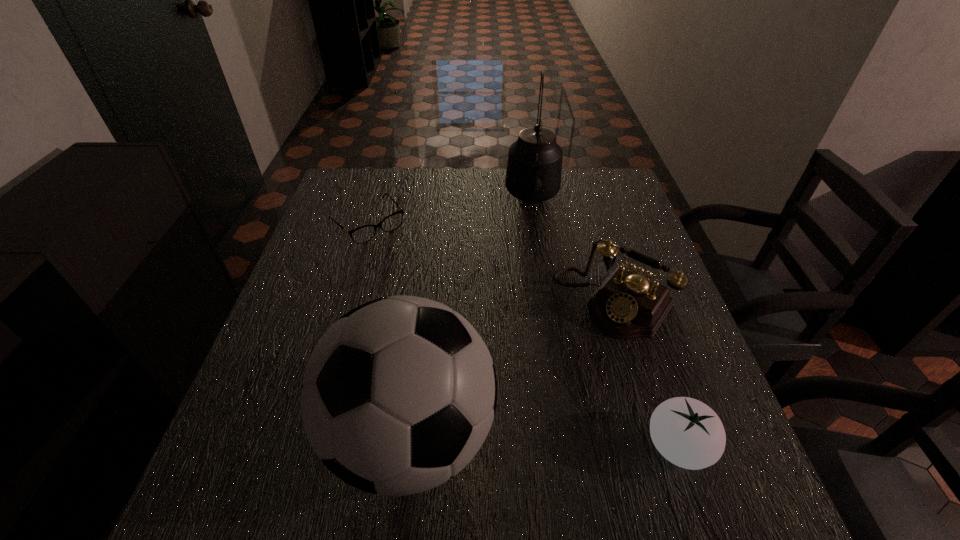
In order to click on free space located 0.070m on the dial of the third farthest object in this screenshot , I will do `click(568, 351)`.

Find the location of a particular element. The image size is (960, 540). vacant space located spout on the tallest object is located at coordinates (532, 319).

Identify the location of vacant area located 0.400m spout on the tallest object. Image resolution: width=960 pixels, height=540 pixels. (532, 329).

I want to click on vacant area situated spout on the tallest object, so click(533, 294).

Image resolution: width=960 pixels, height=540 pixels. What are the coordinates of `free space located 0.210m on the front-facing side of the spectacles` in the screenshot? It's located at (429, 287).

Identify the location of free location located on the front-facing side of the spectacles. This screenshot has width=960, height=540. (473, 333).

Locate an element on the screen. The image size is (960, 540). free space located on the front-facing side of the spectacles is located at coordinates tap(438, 296).

Identify the location of kettle present at the far edge. (534, 167).

At what (x,y) coordinates should I click in order to perform the action: click on spectacles that is at the far edge. Please return your answer as a coordinate pair (x, y). This screenshot has height=540, width=960. Looking at the image, I should click on (363, 234).

Where is `soccer ball that is positioned at the near edge`? Image resolution: width=960 pixels, height=540 pixels. soccer ball that is positioned at the near edge is located at coordinates (398, 396).